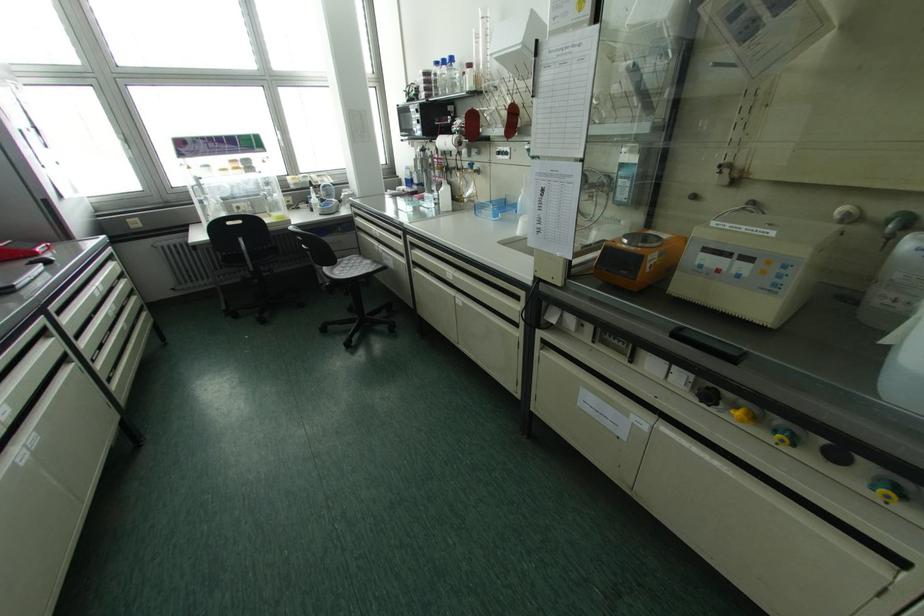
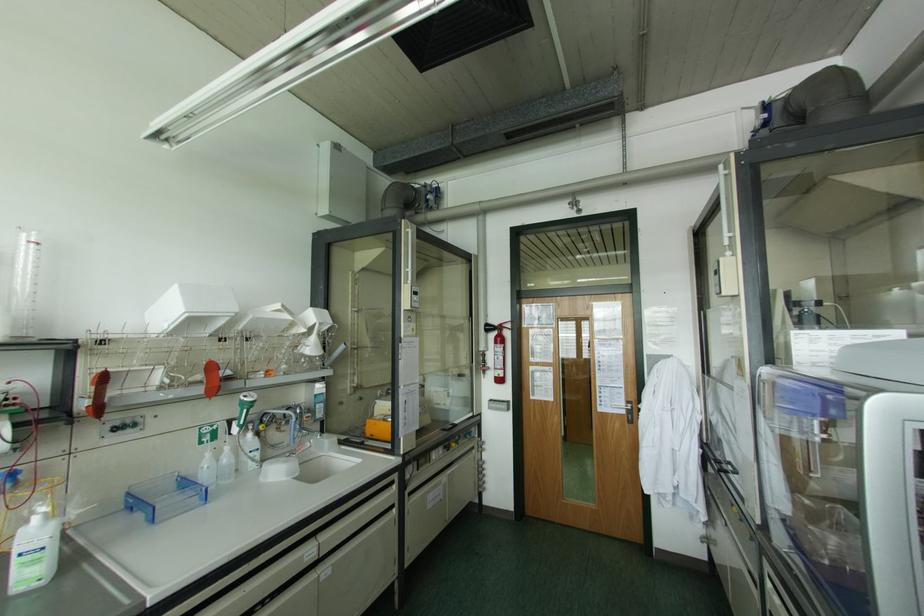
Where in the second image is the point corresponding to (497,153) from the first image?

(115, 428)